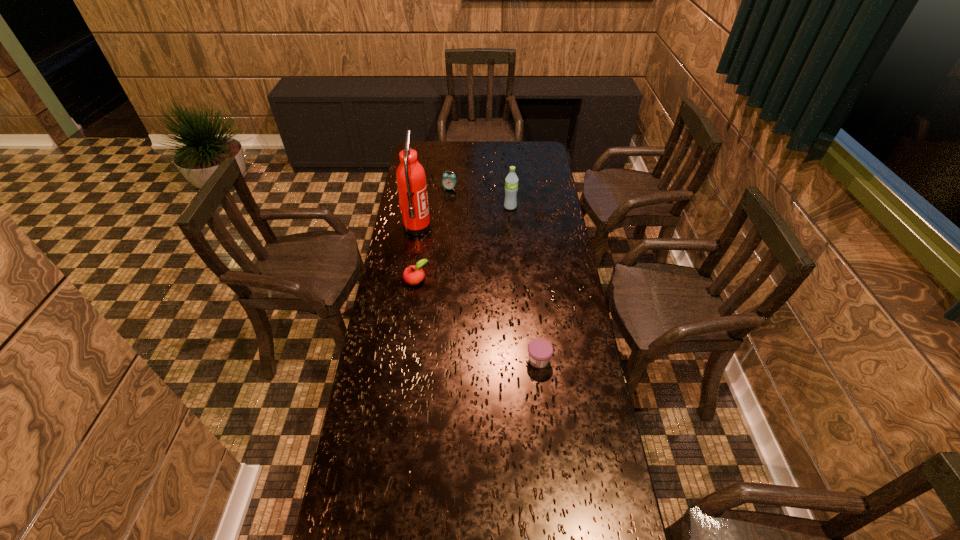
Choose which object is the nearest neighbor to the fourth shortest object. Please provide its 2D coordinates. Your answer should be formatted as a tuple, i.e. [(x, y)], where the tuple contains the x and y coordinates of a point satisfying the conditions above.

[(411, 180)]

Choose which object is the second nearest neighbor to the third tallest object. Please provide its 2D coordinates. Your answer should be formatted as a tuple, i.e. [(x, y)], where the tuple contains the x and y coordinates of a point satisfying the conditions above.

[(511, 181)]

Locate an element on the screen. The image size is (960, 540). free spot that satisfies the following two spatial constraints: 1. on the back side of the apple; 2. on the right side of the water bottle is located at coordinates (426, 207).

Locate an element on the screen. The height and width of the screenshot is (540, 960). blank area in the image that satisfies the following two spatial constraints: 1. on the face of the third tallest object; 2. on the right side of the second farthest object is located at coordinates (448, 207).

I want to click on free region that satisfies the following two spatial constraints: 1. on the face of the alarm clock; 2. on the right side of the water bottle, so click(x=448, y=207).

Where is `vacant space that satisfies the following two spatial constraints: 1. on the back side of the water bottle; 2. on the left side of the apple`? The width and height of the screenshot is (960, 540). vacant space that satisfies the following two spatial constraints: 1. on the back side of the water bottle; 2. on the left side of the apple is located at coordinates (426, 207).